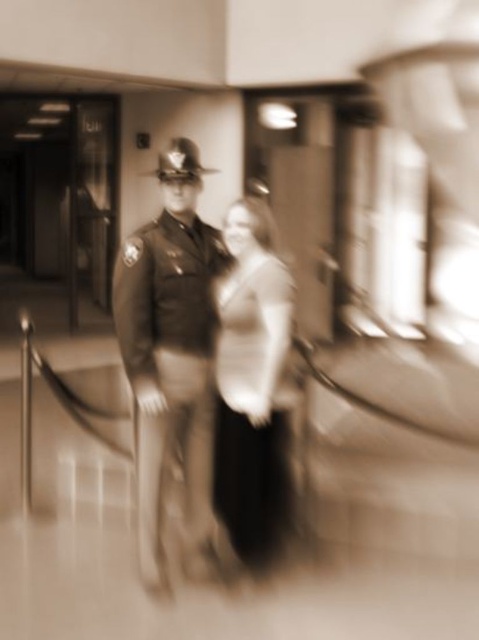
From the picture: You are an interior designer assessing the space in the image. The uniformed officer at center and the matte white blouse at center are both in the same scene. Which object occupies more horizontal space in the image?

The uniformed officer at center occupies more horizontal space in the image because their width surpasses that of the matte white blouse at center.